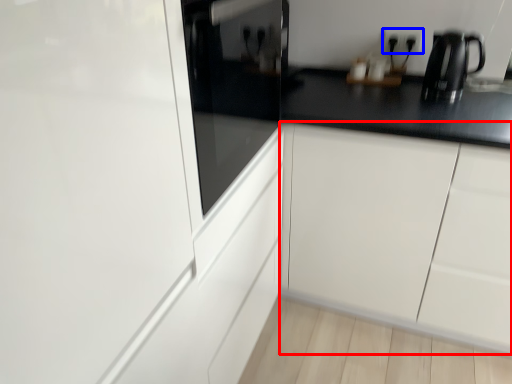
Question: Which object appears closest to the camera in this image, cabinetry (highlighted by a red box) or electric outlet (highlighted by a blue box)?

Choices:
 (A) cabinetry
 (B) electric outlet

Answer: (A)